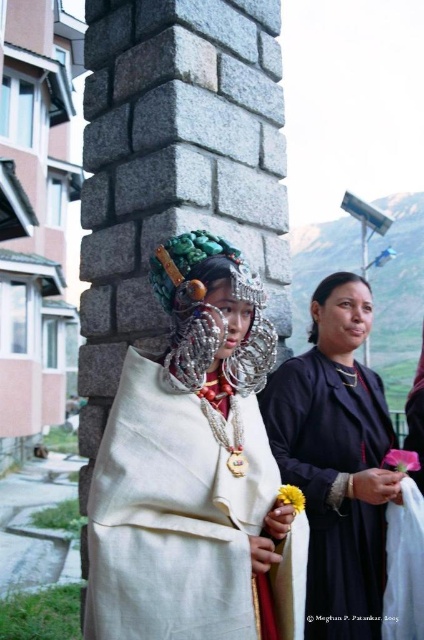
You are organizing a photoshoot and need to decide which outfit to feature based on their visual impact. Given that the white fabric at center and the matte black dress at center are both central to the image, which one would likely draw more attention due to its size?

The white fabric at center would likely draw more attention because its width surpasses that of the matte black dress at center, making it visually more prominent.